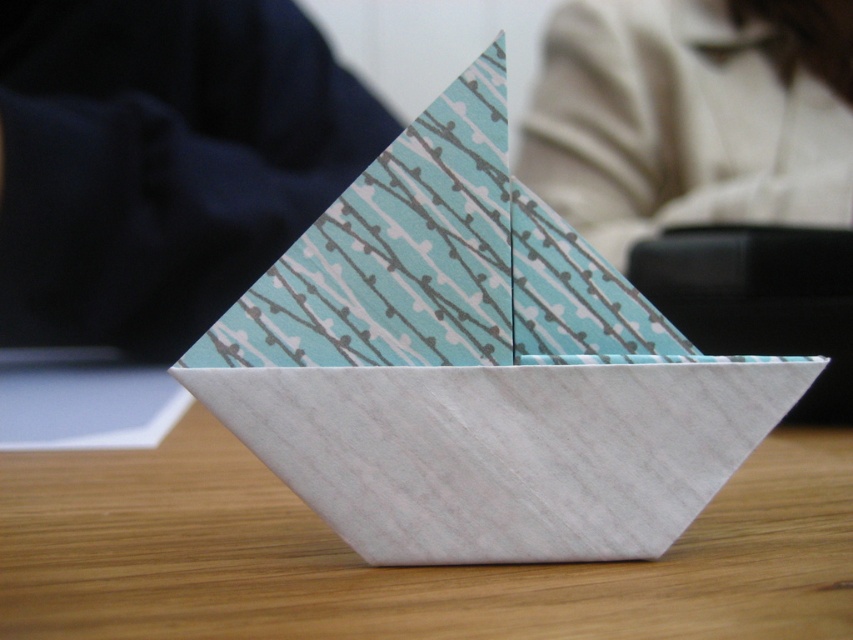
Question: Among these objects, which one is nearest to the camera?

Choices:
 (A) white paper boat at center
 (B) white fabric at upper center
 (C) navy blue fabric at left

Answer: (A)

Question: Estimate the real-world distances between objects in this image. Which object is farther from the white fabric at upper center?

Choices:
 (A) white textured paper boat at center
 (B) navy blue fabric at left
 (C) white paper boat at center

Answer: (A)

Question: Does white textured paper boat at center have a larger size compared to white paper boat at center?

Choices:
 (A) no
 (B) yes

Answer: (A)

Question: Can you confirm if white textured paper boat at center is thinner than navy blue fabric at left?

Choices:
 (A) no
 (B) yes

Answer: (B)

Question: Which object appears closest to the camera in this image?

Choices:
 (A) white paper boat at center
 (B) navy blue fabric at left
 (C) white textured paper boat at center
 (D) white fabric at upper center

Answer: (A)

Question: Does white paper boat at center appear on the left side of navy blue fabric at left?

Choices:
 (A) no
 (B) yes

Answer: (A)